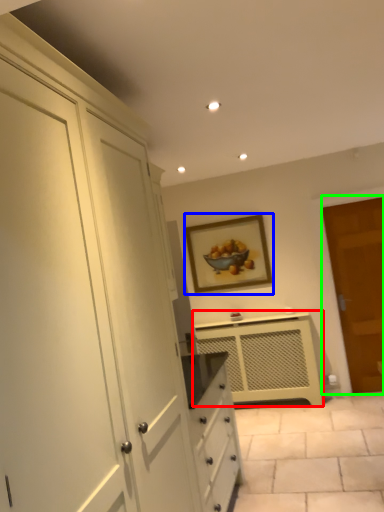
Question: Considering the real-world distances, which object is farthest from cabinetry (highlighted by a red box)? picture frame (highlighted by a blue box) or door (highlighted by a green box)?

Choices:
 (A) picture frame
 (B) door

Answer: (B)